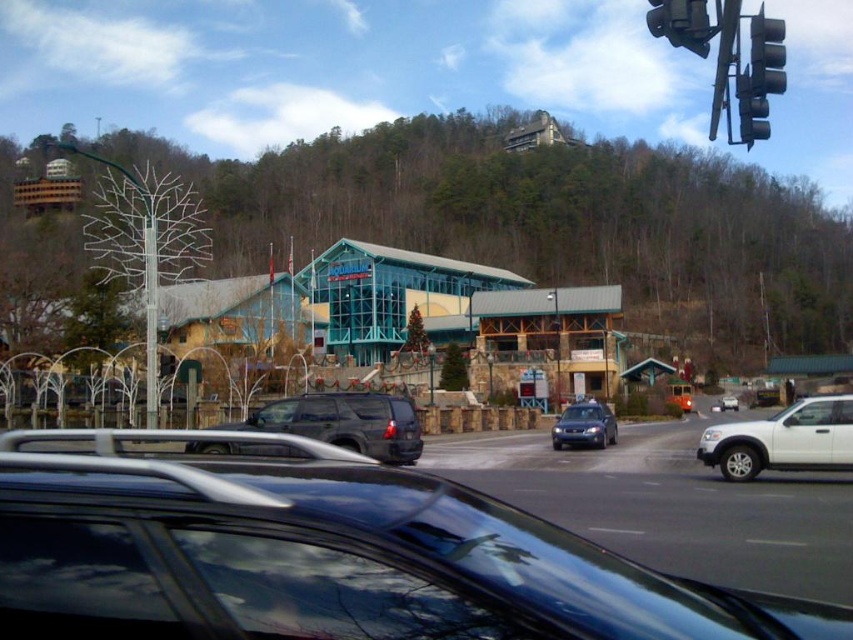
Can you confirm if white matte suv at right is positioned to the left of white matte suv at center?

Correct, you'll find white matte suv at right to the left of white matte suv at center.

Is white matte suv at right bigger than white matte suv at center?

Actually, white matte suv at right might be smaller than white matte suv at center.

Between point (791, 422) and point (720, 400), which one is positioned behind?

Point (720, 400)

The width and height of the screenshot is (853, 640). In order to click on white matte suv at right in this screenshot , I will do `click(782, 440)`.

Is matte black suv at center positioned before metallic blue sedan at center?

That is True.

Can you confirm if matte black suv at center is wider than metallic blue sedan at center?

Indeed, matte black suv at center has a greater width compared to metallic blue sedan at center.

Where is `matte black suv at center`? The image size is (853, 640). matte black suv at center is located at coordinates (344, 422).

Which is in front, point (697, 36) or point (576, 432)?

Positioned in front is point (697, 36).

Who is shorter, metallic black traffic light at upper right or metallic blue sedan at center?

Answer: metallic blue sedan at center is shorter.

Describe the element at coordinates (682, 22) in the screenshot. I see `metallic black traffic light at upper right` at that location.

Locate an element on the screen. metallic black traffic light at upper right is located at coordinates (682, 22).